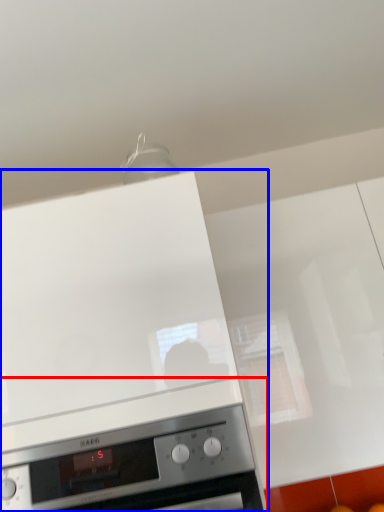
Question: Which point is further to the camera, home appliance (highlighted by a red box) or home appliance (highlighted by a blue box)?

Choices:
 (A) home appliance
 (B) home appliance

Answer: (B)